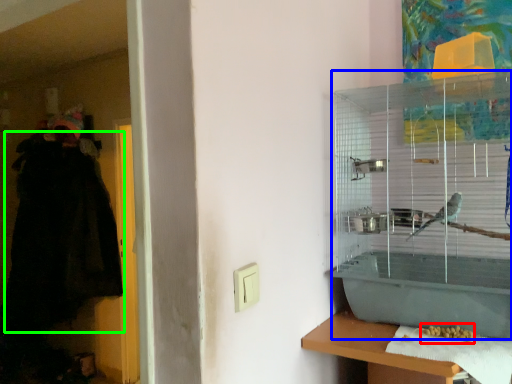
Question: Considering the real-world distances, which object is farthest from food (highlighted by a red box)? bird cage (highlighted by a blue box) or robe (highlighted by a green box)?

Choices:
 (A) bird cage
 (B) robe

Answer: (B)